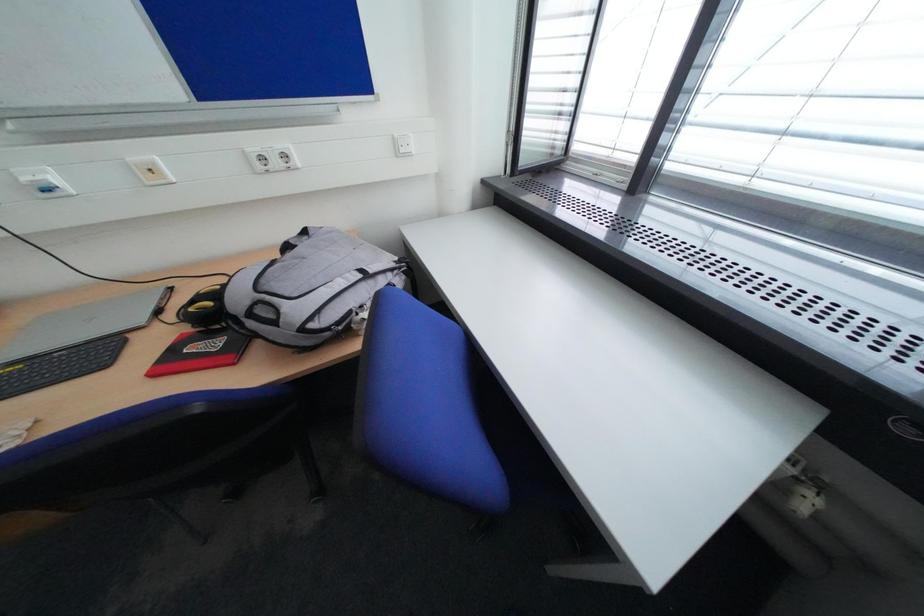
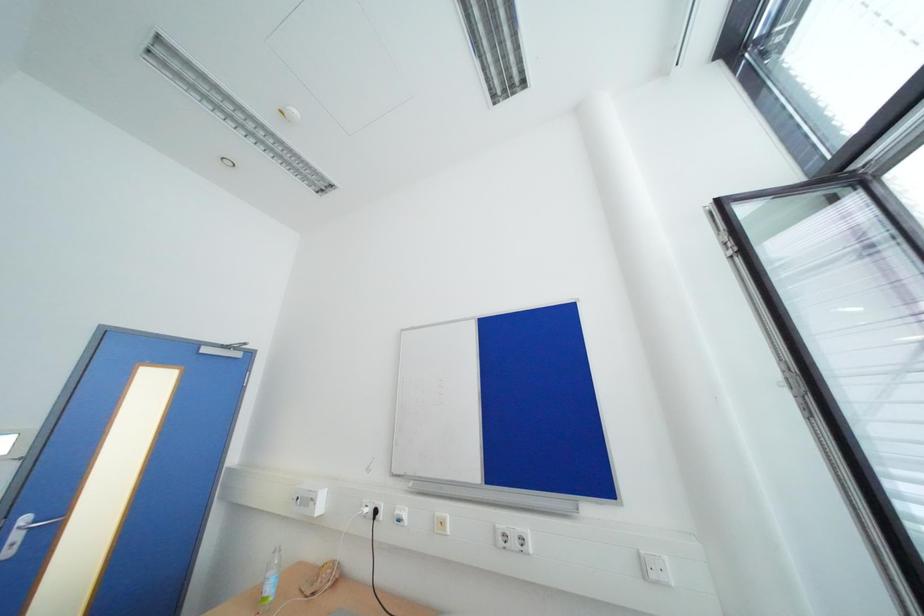
Based on the continuous images, in which direction is the camera rotating?

The camera rotated toward left-up.